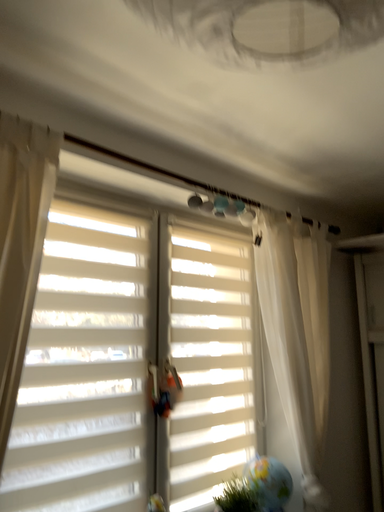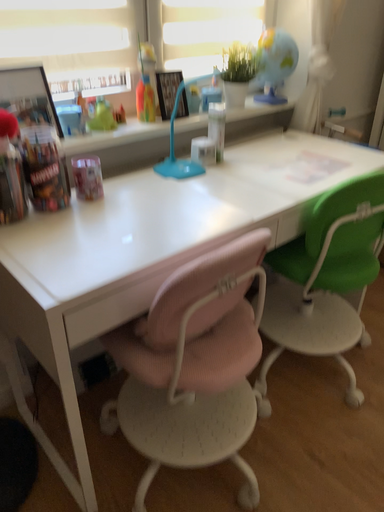
Question: Which way did the camera rotate in the video?

Choices:
 (A) rotated downward
 (B) rotated upward

Answer: (A)